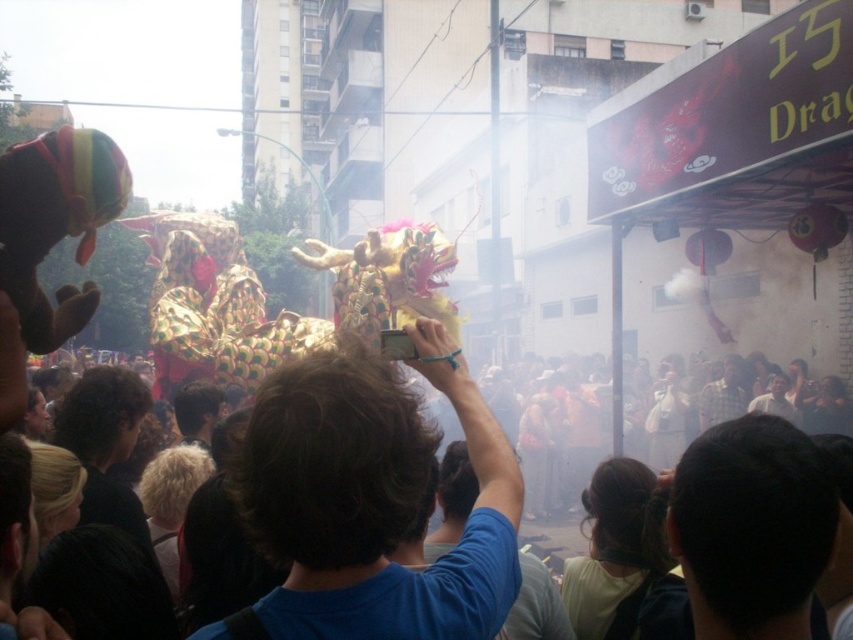
Question: Where is blue fabric shirt at center located in relation to plaid fabric shirt at center in the image?

Choices:
 (A) right
 (B) left

Answer: (B)

Question: Where is blue fabric shirt at center located in relation to blonde hair at center in the image?

Choices:
 (A) right
 (B) left

Answer: (A)

Question: Which object is the farthest from the blonde hair at center?

Choices:
 (A) dark brown hair at center
 (B) plaid fabric shirt at center

Answer: (B)

Question: Can you confirm if blue fabric shirt at center is positioned below dark brown hair at upper center?

Choices:
 (A) no
 (B) yes

Answer: (A)

Question: Which point is closer to the camera?

Choices:
 (A) dark brown hair at center
 (B) dark brown hair at upper center
 (C) blonde hair at center

Answer: (B)

Question: Among these objects, which one is farthest from the camera?

Choices:
 (A) plaid fabric shirt at center
 (B) dark brown hair at center
 (C) dark brown hair at upper center

Answer: (A)